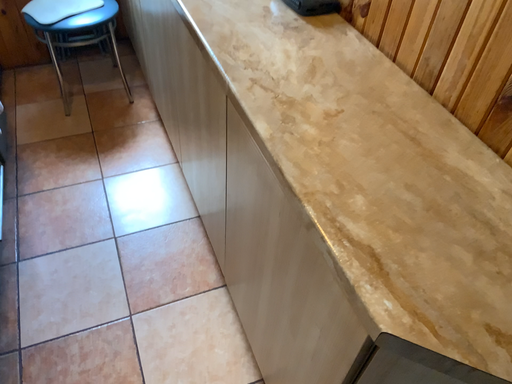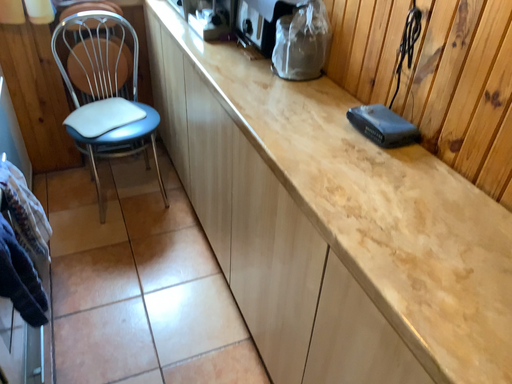
Question: Which way did the camera rotate in the video?

Choices:
 (A) rotated downward
 (B) rotated upward

Answer: (B)